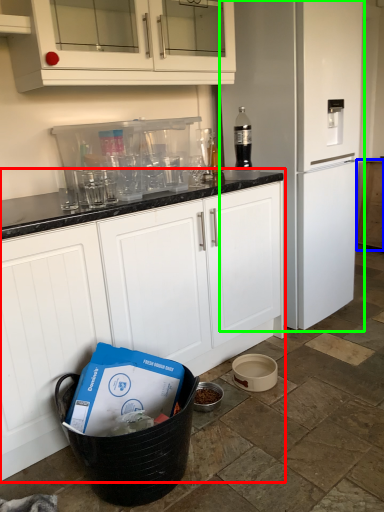
Question: Considering the real-world distances, which object is farthest from cabinetry (highlighted by a red box)? cabinetry (highlighted by a blue box) or home appliance (highlighted by a green box)?

Choices:
 (A) cabinetry
 (B) home appliance

Answer: (A)